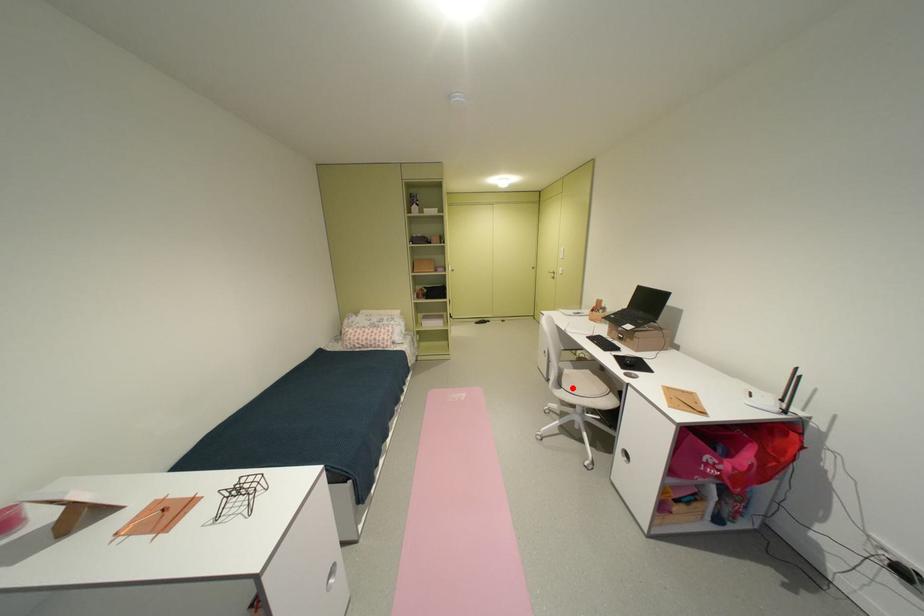
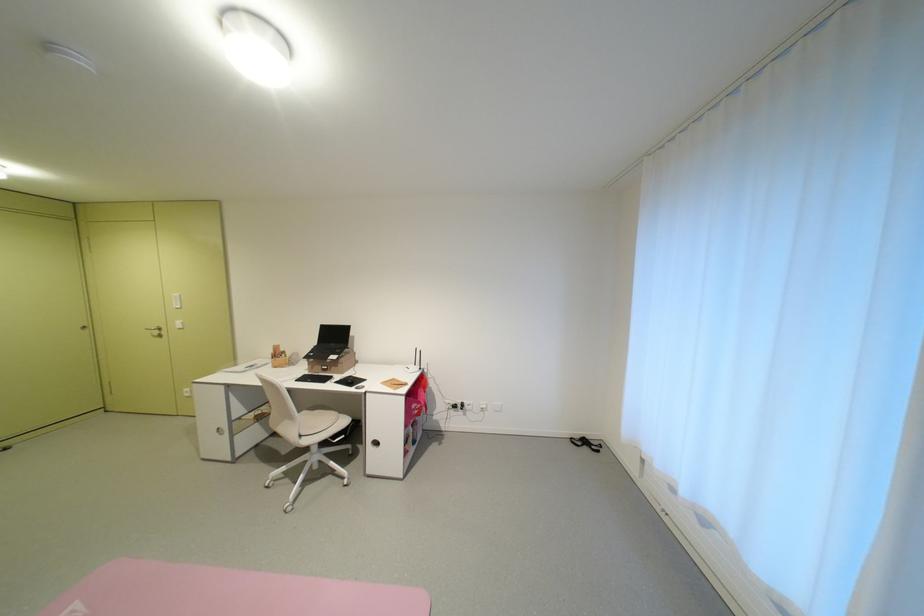
Locate, in the second image, the point that corresponds to the highlighted location in the first image.

(311, 436)